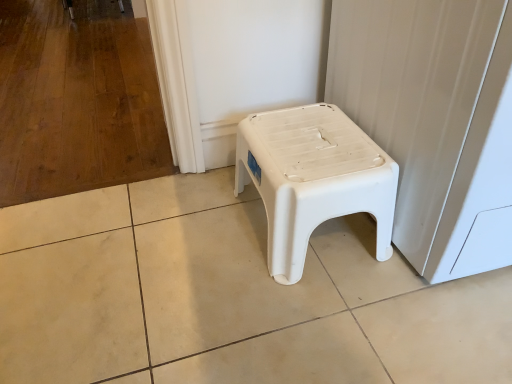
The width and height of the screenshot is (512, 384). Find the location of `free spot above white plastic stool at center (from a real-world perspective)`. free spot above white plastic stool at center (from a real-world perspective) is located at coordinates (309, 142).